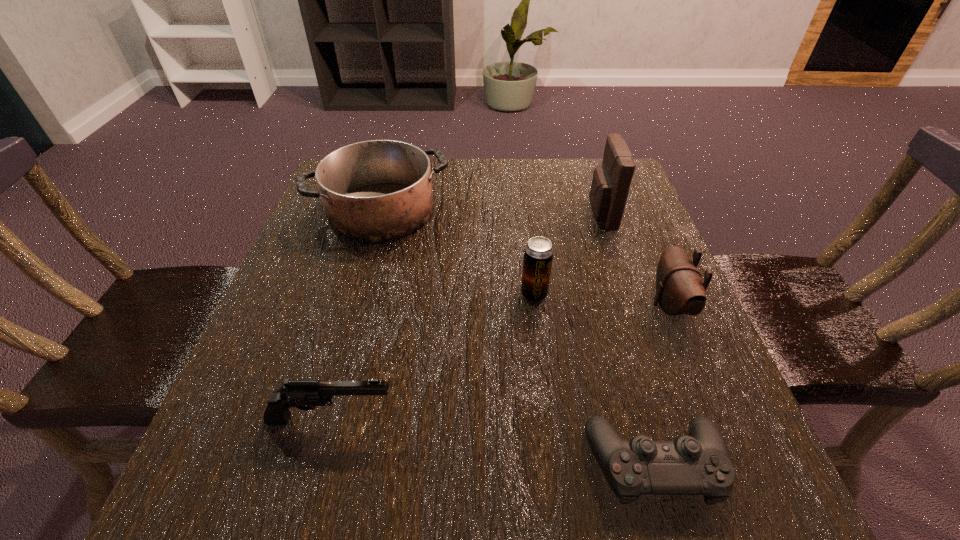
Find the location of a particular element. free area in between the gun and the beer can is located at coordinates point(433,356).

Locate an element on the screen. The height and width of the screenshot is (540, 960). vacant region between the gun and the beer can is located at coordinates (433, 356).

Identify which object is the fourth nearest to the farther pouch. Please provide its 2D coordinates. Your answer should be formatted as a tuple, i.e. [(x, y)], where the tuple contains the x and y coordinates of a point satisfying the conditions above.

[(698, 464)]

Locate an element on the screen. The height and width of the screenshot is (540, 960). the fifth closest object relative to the nearer pouch is located at coordinates (303, 394).

At what (x,y) coordinates should I click in order to perform the action: click on vacant space that satisfies the following two spatial constraints: 1. at the end of the barrel of the gun; 2. on the left side of the control. Please return your answer as a coordinate pair (x, y). Looking at the image, I should click on (320, 464).

Where is `free location that satisfies the following two spatial constraints: 1. with an open flap on the left pouch; 2. on the front side of the control`? This screenshot has width=960, height=540. free location that satisfies the following two spatial constraints: 1. with an open flap on the left pouch; 2. on the front side of the control is located at coordinates (684, 464).

What are the coordinates of `free space that satisfies the following two spatial constraints: 1. with an open flap on the taller pouch; 2. on the front side of the control` in the screenshot? It's located at (684, 464).

Where is `vacant space that satisfies the following two spatial constraints: 1. with an open flap on the taller pouch; 2. on the front side of the shortest object`? This screenshot has width=960, height=540. vacant space that satisfies the following two spatial constraints: 1. with an open flap on the taller pouch; 2. on the front side of the shortest object is located at coordinates (684, 464).